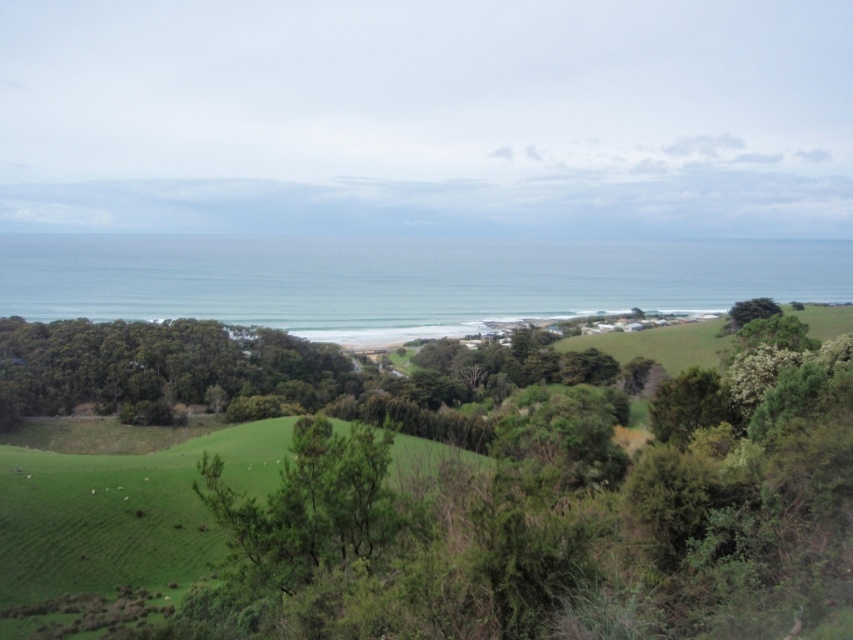
You are standing at point (309, 506) in the coastal landscape. What is the nearest object to you?

The nearest object to you at point (309, 506) is the green leafy tree at center.

You are standing at the camera position observing the coastal landscape. There are two points marked in the image, point 1 at coordinates point (350, 500) and point 2 at coordinates point (735, 326). Which point is nearer to you?

Point (350, 500) is closer to the camera than point (735, 326), so point 1 is nearer to you.

You are standing at the edge of the green fields and want to walk towards the beach. There are two green leafy trees in your path. Which tree, the green leafy tree at center or the green leafy tree at right, is closer to you?

The green leafy tree at center is closer to you because it is positioned under the green leafy tree at right, meaning it is in front of the other tree from your perspective.